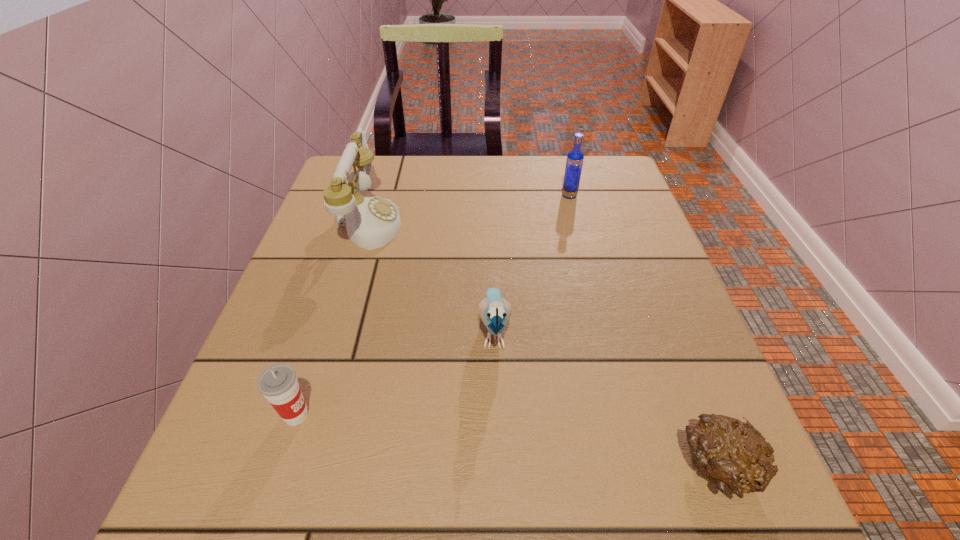
The height and width of the screenshot is (540, 960). In order to click on free space between the second nearest object and the telephone in this screenshot , I will do `click(333, 319)`.

This screenshot has height=540, width=960. Find the location of `free space that is in between the second object from right to left and the shortest object`. free space that is in between the second object from right to left and the shortest object is located at coordinates (644, 332).

In order to click on free area in between the telephone and the muffin in this screenshot , I will do `click(544, 345)`.

This screenshot has height=540, width=960. What are the coordinates of `free space that is in between the bird and the rightmost object` in the screenshot? It's located at point(607,399).

The width and height of the screenshot is (960, 540). Find the location of `empty space between the bird and the shortest object`. empty space between the bird and the shortest object is located at coordinates (607, 399).

Where is `free spot between the second nearest object and the third farthest object`? The width and height of the screenshot is (960, 540). free spot between the second nearest object and the third farthest object is located at coordinates (395, 373).

I want to click on free space that is in between the second object from right to left and the telephone, so click(469, 209).

You are a GUI agent. You are given a task and a screenshot of the screen. Output one action in this format:
    pyautogui.click(x=<x>, y=<y>)
    Task: Click on the unoccupied area between the telephone and the third object from right to left
    
    Given the screenshot: What is the action you would take?
    pyautogui.click(x=432, y=276)

Locate which object ranks third in proximity to the bird. Please provide its 2D coordinates. Your answer should be formatted as a tuple, i.e. [(x, y)], where the tuple contains the x and y coordinates of a point satisfying the conditions above.

[(278, 383)]

This screenshot has height=540, width=960. I want to click on object that ranks as the third closest to the shortest object, so click(x=371, y=222).